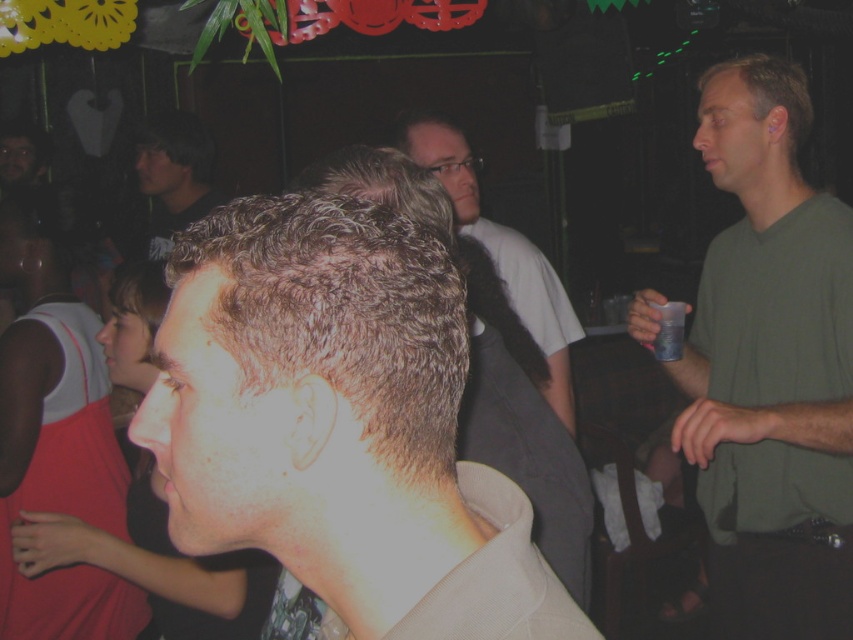
Question: Among these points, which one is nearest to the camera?

Choices:
 (A) (20, 273)
 (B) (653, 298)
 (C) (375, 442)
 (D) (476, 193)

Answer: (C)

Question: Which object is positioned farthest from the white matte shirt at center?

Choices:
 (A) smooth skin face at center
 (B) light brown hair at center
 (C) dark brown hair at upper left
 (D) green matte shirt at right

Answer: (C)

Question: Is light brown hair at center smaller than green matte shirt at right?

Choices:
 (A) yes
 (B) no

Answer: (A)

Question: Does smooth skin face at center have a smaller size compared to dark brown hair at upper left?

Choices:
 (A) no
 (B) yes

Answer: (A)

Question: Which point is closer to the camera taking this photo?

Choices:
 (A) (93, 362)
 (B) (811, 492)

Answer: (B)

Question: Is green matte shirt at right thinner than dark brown hair at upper left?

Choices:
 (A) no
 (B) yes

Answer: (B)